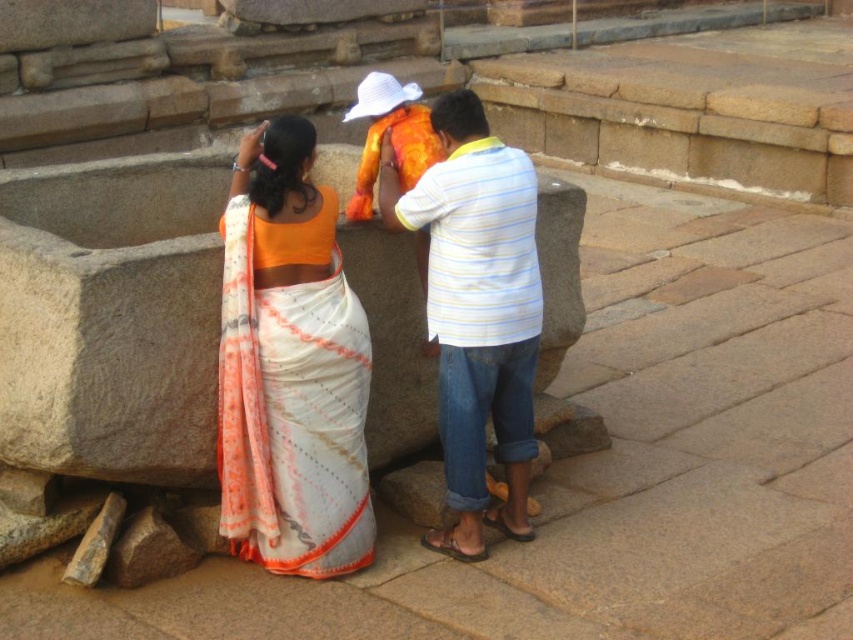
Question: Is orange cotton saree at center to the right of white silk saree at center from the viewer's perspective?

Choices:
 (A) no
 (B) yes

Answer: (A)

Question: Estimate the real-world distances between objects in this image. Which object is farther from the white silk saree at center?

Choices:
 (A) orange cotton saree at center
 (B) white striped shirt at center

Answer: (B)

Question: Considering the relative positions of orange cotton saree at center and white silk saree at center in the image provided, where is orange cotton saree at center located with respect to white silk saree at center?

Choices:
 (A) below
 (B) above

Answer: (A)

Question: Estimate the real-world distances between objects in this image. Which object is farther from the orange cotton saree at center?

Choices:
 (A) white silk saree at center
 (B) white striped shirt at center

Answer: (B)

Question: Which point is farther to the camera?

Choices:
 (A) (424, 538)
 (B) (257, 365)

Answer: (A)

Question: Does white silk saree at center appear under white striped shirt at center?

Choices:
 (A) no
 (B) yes

Answer: (B)